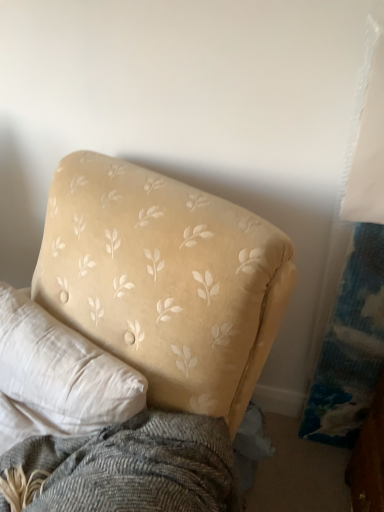
The height and width of the screenshot is (512, 384). Describe the element at coordinates (57, 376) in the screenshot. I see `beige fabric pillow at upper left` at that location.

Image resolution: width=384 pixels, height=512 pixels. I want to click on beige fabric pillow at upper left, so 57,376.

Measure the distance between point (81, 381) and camera.

The depth of point (81, 381) is 31.77 inches.

This screenshot has height=512, width=384. What do you see at coordinates (156, 332) in the screenshot?
I see `velvet yellow couch at upper left` at bounding box center [156, 332].

Identify the location of velvet yellow couch at upper left. (156, 332).

Based on the photo, what is the approximate width of velvet yellow couch at upper left?

It is 24.14 inches.

What are the coordinates of `beige fabric pillow at upper left` in the screenshot? It's located at (57, 376).

Which is more to the left, beige fabric pillow at upper left or velvet yellow couch at upper left?

beige fabric pillow at upper left.

Based on the photo, is the depth of beige fabric pillow at upper left less than that of velvet yellow couch at upper left?

No, it is behind velvet yellow couch at upper left.

Does point (0, 387) lie in front of point (204, 338)?

No.

From the image's perspective, between beige fabric pillow at upper left and velvet yellow couch at upper left, who is located below?

velvet yellow couch at upper left, from the image's perspective.

From a real-world perspective, relative to velvet yellow couch at upper left, is beige fabric pillow at upper left vertically above or below?

beige fabric pillow at upper left is above velvet yellow couch at upper left.

Can you confirm if beige fabric pillow at upper left is thinner than velvet yellow couch at upper left?

Yes.

Between beige fabric pillow at upper left and velvet yellow couch at upper left, which one has less height?

With less height is beige fabric pillow at upper left.

Consider the image. Does beige fabric pillow at upper left have a smaller size compared to velvet yellow couch at upper left?

Yes.

Is beige fabric pillow at upper left inside the boundaries of velvet yellow couch at upper left, or outside?

The correct answer is: inside.

Is beige fabric pillow at upper left not close to velvet yellow couch at upper left?

beige fabric pillow at upper left is near velvet yellow couch at upper left, not far away.

Is beige fabric pillow at upper left turned away from velvet yellow couch at upper left?

Absolutely, beige fabric pillow at upper left is directed away from velvet yellow couch at upper left.

How different are the orientations of beige fabric pillow at upper left and velvet yellow couch at upper left in degrees?

The angle between the facing direction of beige fabric pillow at upper left and the facing direction of velvet yellow couch at upper left is 1.15 degrees.

Find the location of a particular element. The height and width of the screenshot is (512, 384). studio couch that appears on the right of beige fabric pillow at upper left is located at coordinates (156, 332).

Which object is positioned more to the left, velvet yellow couch at upper left or beige fabric pillow at upper left?

beige fabric pillow at upper left is more to the left.

Which object is further away from the camera, velvet yellow couch at upper left or beige fabric pillow at upper left?

beige fabric pillow at upper left is more distant.

Considering the points (243, 381) and (0, 302), which point is behind, point (243, 381) or point (0, 302)?

The point (0, 302) is behind.

From the image's perspective, between velvet yellow couch at upper left and beige fabric pillow at upper left, which one is located above?

From the image's view, beige fabric pillow at upper left is above.

Based on the photo, from a real-world perspective, is velvet yellow couch at upper left located higher than beige fabric pillow at upper left?

Actually, velvet yellow couch at upper left is physically below beige fabric pillow at upper left in the real world.

Which object is thinner, velvet yellow couch at upper left or beige fabric pillow at upper left?

beige fabric pillow at upper left is thinner.

Can you confirm if velvet yellow couch at upper left is shorter than beige fabric pillow at upper left?

In fact, velvet yellow couch at upper left may be taller than beige fabric pillow at upper left.

Is velvet yellow couch at upper left smaller than beige fabric pillow at upper left?

No.

Can we say velvet yellow couch at upper left lies outside beige fabric pillow at upper left?

Absolutely, velvet yellow couch at upper left is external to beige fabric pillow at upper left.

Is velvet yellow couch at upper left beside beige fabric pillow at upper left?

No, velvet yellow couch at upper left is not in contact with beige fabric pillow at upper left.

Is velvet yellow couch at upper left aimed at beige fabric pillow at upper left?

Yes, velvet yellow couch at upper left faces towards beige fabric pillow at upper left.

Image resolution: width=384 pixels, height=512 pixels. What are the coordinates of `pillow that appears behind the velvet yellow couch at upper left` in the screenshot? It's located at (57, 376).

The height and width of the screenshot is (512, 384). Find the location of `studio couch in front of the beige fabric pillow at upper left`. studio couch in front of the beige fabric pillow at upper left is located at coordinates (156, 332).

Locate an element on the screen. pillow above the velvet yellow couch at upper left (from the image's perspective) is located at coordinates (57, 376).